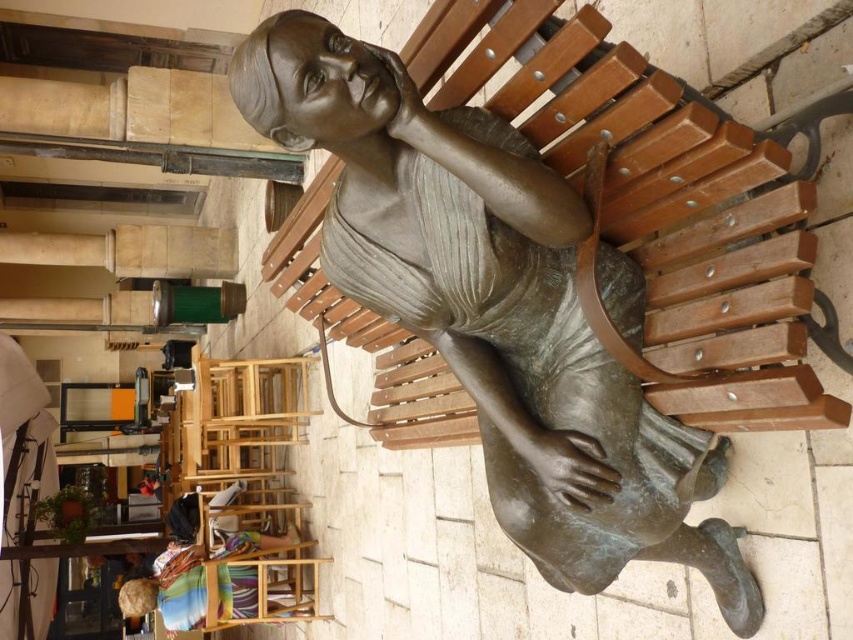
Question: Which point is farther to the camera?

Choices:
 (A) (221, 564)
 (B) (492, 429)

Answer: (A)

Question: Is bronze statue at center wider than multicolored fabric at lower left?

Choices:
 (A) no
 (B) yes

Answer: (A)

Question: Can you confirm if bronze statue at center is smaller than multicolored fabric at lower left?

Choices:
 (A) no
 (B) yes

Answer: (A)

Question: Which object is farther from the camera taking this photo?

Choices:
 (A) bronze statue at center
 (B) multicolored fabric at lower left

Answer: (B)

Question: Does bronze statue at center appear on the left side of multicolored fabric at lower left?

Choices:
 (A) no
 (B) yes

Answer: (A)